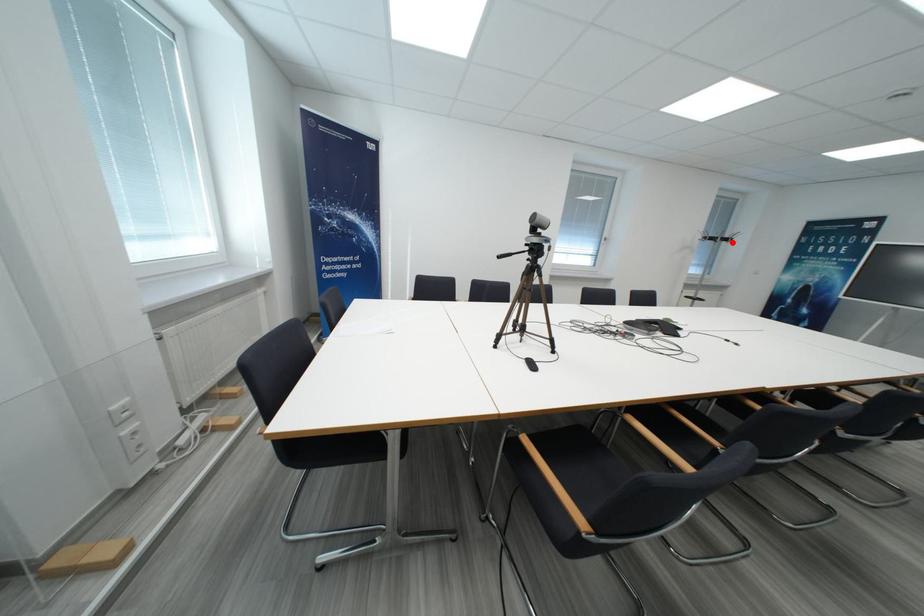
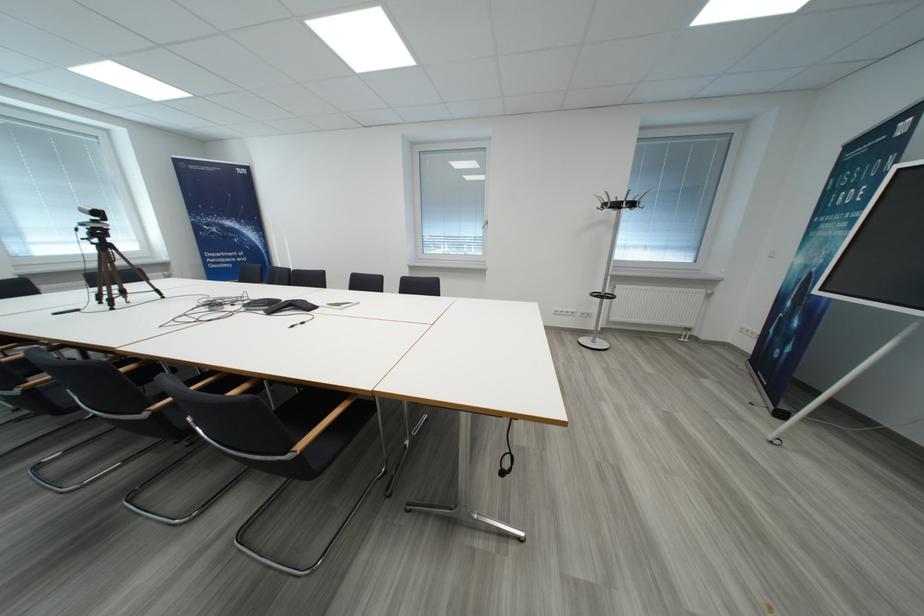
Find the pixel in the second image that matches the highlighted location in the first image.

(623, 208)